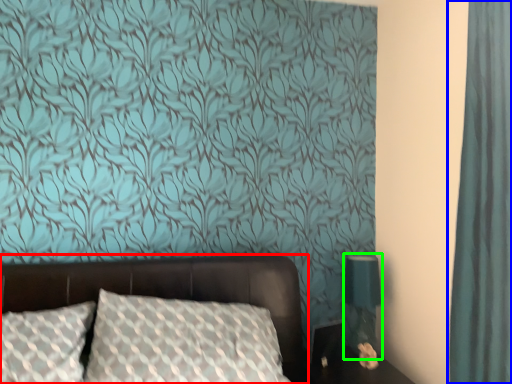
Question: Which is farther away from bed (highlighted by a red box)? curtain (highlighted by a blue box) or table lamp (highlighted by a green box)?

Choices:
 (A) curtain
 (B) table lamp

Answer: (A)